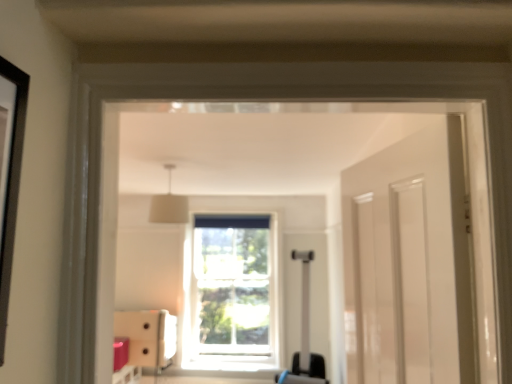
What do you see at coordinates (148, 336) in the screenshot? I see `matte white cabinet at lower left` at bounding box center [148, 336].

Measure the distance between white fabric lampshade at upper center and camera.

9.11 feet.

Measure the distance between point (253, 332) and camera.

Point (253, 332) and camera are 4.84 meters apart from each other.

This screenshot has width=512, height=384. In order to click on matte white cabinet at lower left in this screenshot , I will do `click(148, 336)`.

Can you confirm if matte white cabinet at lower left is bigger than clear glass window at center?

No.

Consider the image. Can you confirm if matte white cabinet at lower left is positioned to the left of clear glass window at center?

Yes, matte white cabinet at lower left is to the left of clear glass window at center.

This screenshot has width=512, height=384. I want to click on window lying on the right of matte white cabinet at lower left, so click(x=232, y=292).

How many degrees apart are the facing directions of matte white cabinet at lower left and clear glass window at center?

The facing directions of matte white cabinet at lower left and clear glass window at center are 0.0138 degrees apart.

Is white fabric lampshade at upper center positioned with its back to matte white cabinet at lower left?

No.

Does white fabric lampshade at upper center have a greater width compared to matte white cabinet at lower left?

Incorrect, the width of white fabric lampshade at upper center does not surpass that of matte white cabinet at lower left.

Considering the positions of points (169, 221) and (149, 335), is point (169, 221) closer to camera compared to point (149, 335)?

Yes.

From the image's perspective, is white fabric lampshade at upper center positioned above or below matte white cabinet at lower left?

Clearly, from the image's perspective, white fabric lampshade at upper center is above matte white cabinet at lower left.

Does clear glass window at center have a larger size compared to matte black suitcase at center?

Incorrect, clear glass window at center is not larger than matte black suitcase at center.

From the picture: From a real-world perspective, is clear glass window at center positioned above or below matte black suitcase at center?

clear glass window at center is situated higher than matte black suitcase at center in the real world.

Is clear glass window at center surrounding matte black suitcase at center?

No.

Does clear glass window at center turn towards matte black suitcase at center?

Yes.

Is matte white cabinet at lower left in contact with white fabric lampshade at upper center?

No, matte white cabinet at lower left is not with white fabric lampshade at upper center.

Considering the positions of points (129, 325) and (165, 203), is point (129, 325) closer to camera compared to point (165, 203)?

No, it is behind (165, 203).

Would you say matte white cabinet at lower left is inside or outside white fabric lampshade at upper center?

matte white cabinet at lower left is outside white fabric lampshade at upper center.

Does white fabric lampshade at upper center have a greater width compared to matte black suitcase at center?

Incorrect, the width of white fabric lampshade at upper center does not surpass that of matte black suitcase at center.

How many degrees apart are the facing directions of white fabric lampshade at upper center and matte black suitcase at center?

white fabric lampshade at upper center and matte black suitcase at center are facing 87 degrees away from each other.

From the image's perspective, is white fabric lampshade at upper center above or below matte black suitcase at center?

Based on their image positions, white fabric lampshade at upper center is located above matte black suitcase at center.

This screenshot has height=384, width=512. I want to click on luggage directly beneath the white fabric lampshade at upper center (from a real-world perspective), so click(x=304, y=336).

Is clear glass window at center situated inside white fabric lampshade at upper center or outside?

clear glass window at center is spatially situated outside white fabric lampshade at upper center.

Is point (199, 294) more distant than point (180, 200)?

That is True.

Does clear glass window at center have a lesser height compared to white fabric lampshade at upper center?

No.

Which is more to the left, clear glass window at center or white fabric lampshade at upper center?

Positioned to the left is white fabric lampshade at upper center.

Is matte black suitcase at center facing towards white fabric lampshade at upper center?

No.

Considering their positions, is matte black suitcase at center located in front of or behind white fabric lampshade at upper center?

matte black suitcase at center is positioned farther from the viewer than white fabric lampshade at upper center.

Looking at this image, considering the relative sizes of matte black suitcase at center and white fabric lampshade at upper center in the image provided, is matte black suitcase at center shorter than white fabric lampshade at upper center?

No.

Looking at this image, from the image's perspective, would you say matte black suitcase at center is shown under white fabric lampshade at upper center?

Correct, matte black suitcase at center appears lower than white fabric lampshade at upper center in the image.

You are a GUI agent. You are given a task and a screenshot of the screen. Output one action in this format:
    pyautogui.click(x=<x>, y=<y>)
    Task: Click on the furniture located underneath the clear glass window at center (from a real-world perspective)
    The height and width of the screenshot is (384, 512).
    Given the screenshot: What is the action you would take?
    pyautogui.click(x=148, y=336)

The image size is (512, 384). Find the location of `light fixture above the matte white cabinet at lower left (from a real-world perspective)`. light fixture above the matte white cabinet at lower left (from a real-world perspective) is located at coordinates (169, 204).

Looking at the image, which one is located closer to clear glass window at center, matte black suitcase at center or white fabric lampshade at upper center?

matte black suitcase at center lies closer to clear glass window at center than the other object.

Based on their spatial positions, is clear glass window at center or matte white cabinet at lower left closer to matte black suitcase at center?

clear glass window at center is closer to matte black suitcase at center.

Estimate the real-world distances between objects in this image. Which object is further from clear glass window at center, white fabric lampshade at upper center or matte white cabinet at lower left?

white fabric lampshade at upper center is further to clear glass window at center.

Based on the photo, which object lies further to the anchor point white fabric lampshade at upper center, clear glass window at center or matte white cabinet at lower left?

Among the two, clear glass window at center is located further to white fabric lampshade at upper center.

When comparing their distances from matte white cabinet at lower left, does white fabric lampshade at upper center or matte black suitcase at center seem closer?

The object closer to matte white cabinet at lower left is matte black suitcase at center.

Looking at this image, based on their spatial positions, is white fabric lampshade at upper center or matte white cabinet at lower left further from matte black suitcase at center?

white fabric lampshade at upper center.

Which object lies further to the anchor point matte black suitcase at center, matte white cabinet at lower left or white fabric lampshade at upper center?

The object further to matte black suitcase at center is white fabric lampshade at upper center.

Based on their spatial positions, is matte white cabinet at lower left or clear glass window at center closer to white fabric lampshade at upper center?

matte white cabinet at lower left lies closer to white fabric lampshade at upper center than the other object.

The image size is (512, 384). Identify the location of window between matte white cabinet at lower left and matte black suitcase at center in the horizontal direction. (232, 292).

The image size is (512, 384). Find the location of `luggage between white fabric lampshade at upper center and clear glass window at center along the z-axis`. luggage between white fabric lampshade at upper center and clear glass window at center along the z-axis is located at coordinates (304, 336).

This screenshot has height=384, width=512. I want to click on furniture positioned between white fabric lampshade at upper center and clear glass window at center from near to far, so pyautogui.click(x=148, y=336).

This screenshot has height=384, width=512. Identify the location of light fixture situated between matte white cabinet at lower left and matte black suitcase at center from left to right. (169, 204).